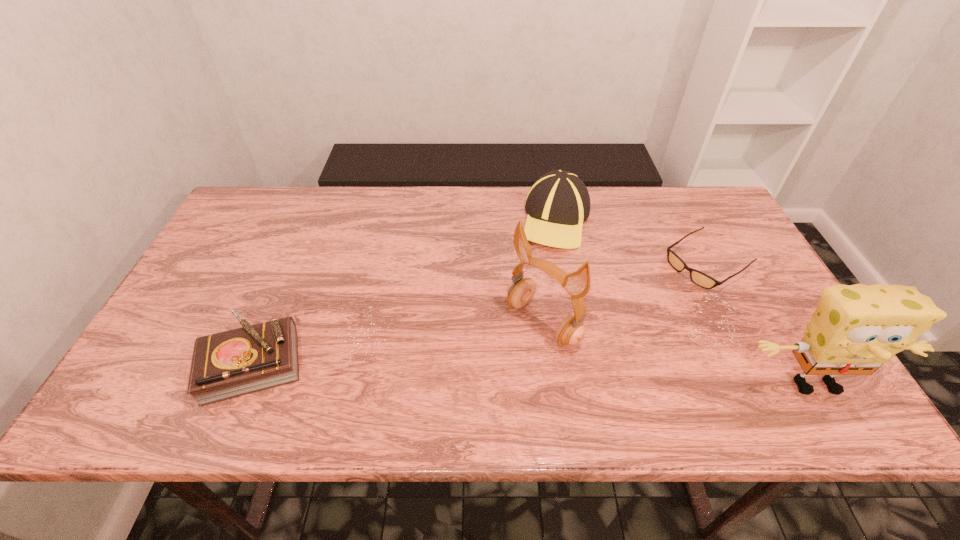
What are the coordinates of `vacant area that lies between the sunglasses and the earphone` in the screenshot? It's located at tap(625, 293).

I want to click on vacant space in between the second shortest object and the earphone, so click(x=397, y=343).

Locate an element on the screen. Image resolution: width=960 pixels, height=540 pixels. free space between the earphone and the sunglasses is located at coordinates (625, 293).

Locate an element on the screen. free spot between the sunglasses and the diary is located at coordinates (480, 313).

Locate an element on the screen. The image size is (960, 540). free space between the leftmost object and the baseball cap is located at coordinates (404, 291).

You are a GUI agent. You are given a task and a screenshot of the screen. Output one action in this format:
    pyautogui.click(x=<x>, y=<y>)
    Task: Click on the vacant space that's between the leftmost object and the baseball cap
    
    Given the screenshot: What is the action you would take?
    pyautogui.click(x=404, y=291)

Image resolution: width=960 pixels, height=540 pixels. I want to click on vacant space that is in between the sponge and the shortest object, so click(x=760, y=323).

At what (x,y) coordinates should I click in order to perform the action: click on free space that is in between the shortest object and the sponge. Please return your answer as a coordinate pair (x, y). The width and height of the screenshot is (960, 540). Looking at the image, I should click on (760, 323).

Locate an element on the screen. The image size is (960, 540). free area in between the fourth tallest object and the sponge is located at coordinates (534, 373).

This screenshot has height=540, width=960. Identify the location of object that stands as the second closest to the third shortest object. (699, 278).